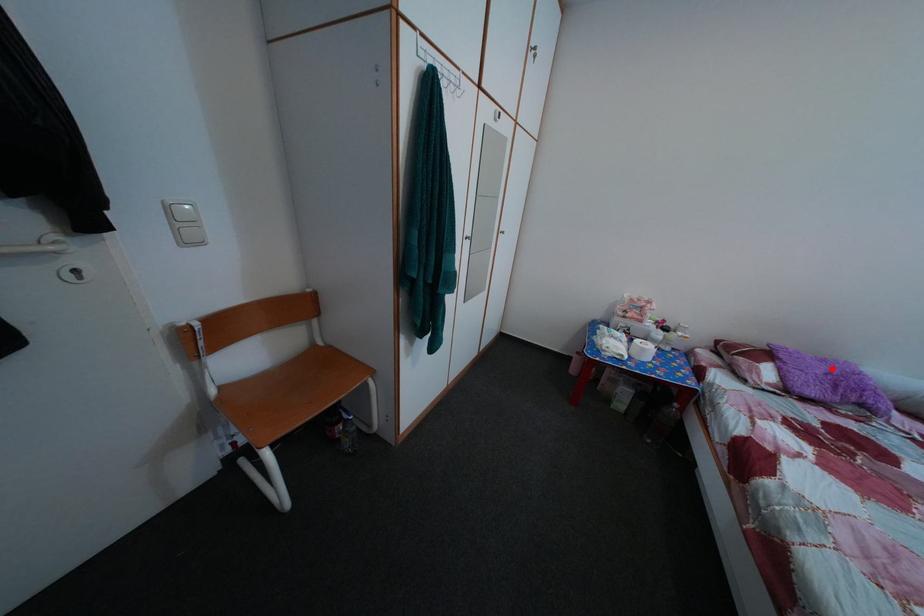
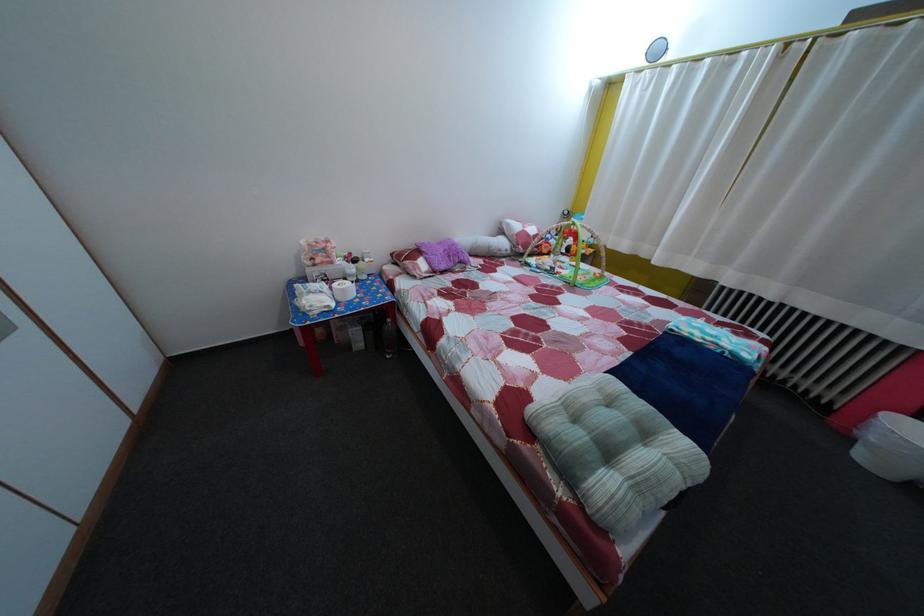
Where in the second image is the point corresponding to the highlighted location from the first image?

(450, 252)